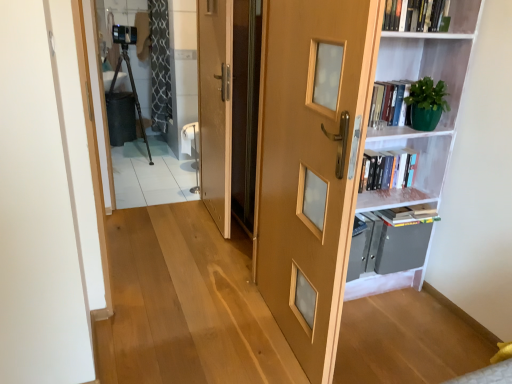
Question: Should I look upward or downward to see white matte bookshelf at right?

Choices:
 (A) down
 (B) up

Answer: (B)

Question: Is clear glass door at upper left bigger than white matte bookshelf at right?

Choices:
 (A) yes
 (B) no

Answer: (B)

Question: Considering the relative sizes of clear glass door at upper left and white matte bookshelf at right in the image provided, is clear glass door at upper left shorter than white matte bookshelf at right?

Choices:
 (A) yes
 (B) no

Answer: (A)

Question: Can white matte bookshelf at right be found inside clear glass door at upper left?

Choices:
 (A) no
 (B) yes

Answer: (A)

Question: Is clear glass door at upper left looking in the opposite direction of white matte bookshelf at right?

Choices:
 (A) no
 (B) yes

Answer: (A)

Question: Does clear glass door at upper left have a greater height compared to white matte bookshelf at right?

Choices:
 (A) no
 (B) yes

Answer: (A)

Question: Is clear glass door at upper left at the right side of white matte bookshelf at right?

Choices:
 (A) yes
 (B) no

Answer: (B)

Question: Can you confirm if wooden door at center, which is the second door from right to left, is shorter than transparent glass screen door at center?

Choices:
 (A) yes
 (B) no

Answer: (B)

Question: Considering the relative sizes of wooden door at center, the first door viewed from the left, and transparent glass screen door at center in the image provided, is wooden door at center, the first door viewed from the left, taller than transparent glass screen door at center?

Choices:
 (A) no
 (B) yes

Answer: (B)

Question: Could you tell me if wooden door at center, which ranks as the first door in back-to-front order, is facing transparent glass screen door at center?

Choices:
 (A) no
 (B) yes

Answer: (B)

Question: From the image's perspective, does wooden door at center, which is the second door from right to left, appear lower than transparent glass screen door at center?

Choices:
 (A) no
 (B) yes

Answer: (A)

Question: Can you confirm if wooden door at center, which ranks as the first door in back-to-front order, is smaller than transparent glass screen door at center?

Choices:
 (A) no
 (B) yes

Answer: (A)

Question: Is wooden door at center, positioned as the 2th door in front-to-back order, not inside transparent glass screen door at center?

Choices:
 (A) no
 (B) yes

Answer: (B)

Question: From a real-world perspective, is hardcover book at upper right, the first book positioned from the bottom, below black textured curtain at upper left?

Choices:
 (A) no
 (B) yes

Answer: (B)